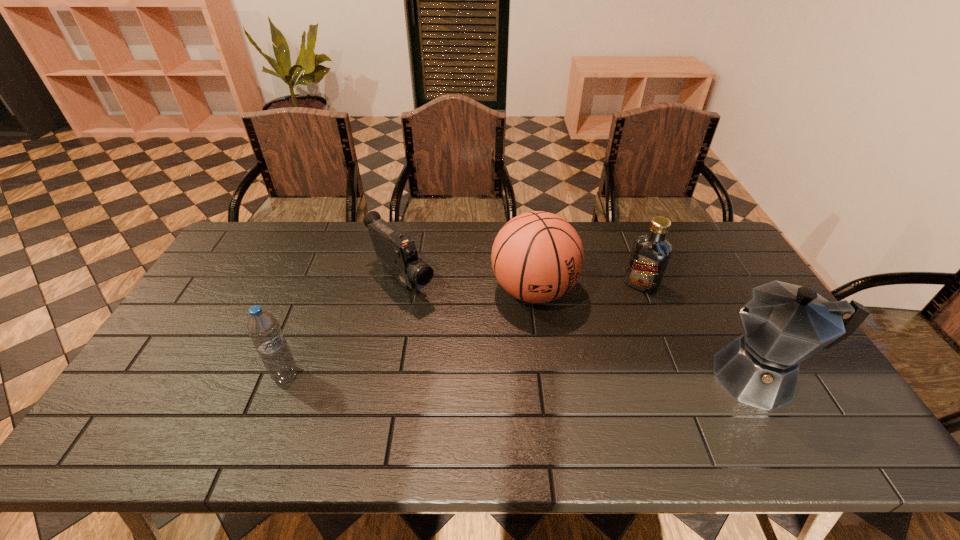
Locate an element on the screen. The width and height of the screenshot is (960, 540). free space located on the front-facing side of the camcorder is located at coordinates (513, 385).

This screenshot has height=540, width=960. In order to click on vacant position located 0.260m on the front-facing side of the camcorder in this screenshot , I will do `click(479, 354)`.

Find the location of a particular element. The height and width of the screenshot is (540, 960). vacant point located 0.290m on the front-facing side of the camcorder is located at coordinates (487, 361).

At what (x,y) coordinates should I click in order to perform the action: click on free spot located 0.120m on the front-facing side of the second object from right to left. Please return your answer as a coordinate pair (x, y). The width and height of the screenshot is (960, 540). Looking at the image, I should click on (619, 316).

Locate an element on the screen. The height and width of the screenshot is (540, 960). vacant area located 0.150m on the front-facing side of the second object from right to left is located at coordinates (615, 322).

At what (x,y) coordinates should I click in order to perform the action: click on free region located 0.360m on the front-facing side of the second object from right to left. Please return your answer as a coordinate pair (x, y). Looking at the image, I should click on (583, 370).

Find the location of a particular element. vacant space positioned on the surface of the third object from left to right near the brand logo is located at coordinates (584, 364).

Identify the location of free space located on the surface of the third object from left to right near the brand logo. (588, 370).

Where is `free space located on the surface of the third object from left to right near the brand logo`? free space located on the surface of the third object from left to right near the brand logo is located at coordinates (574, 350).

You are a GUI agent. You are given a task and a screenshot of the screen. Output one action in this format:
    pyautogui.click(x=<x>, y=<y>)
    Task: Click on the camcorder present at the far edge
    This screenshot has height=540, width=960.
    Given the screenshot: What is the action you would take?
    pyautogui.click(x=397, y=253)